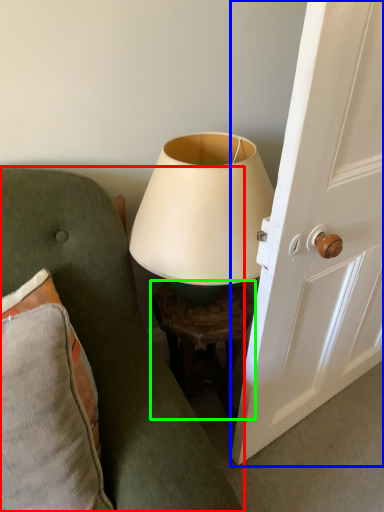
Question: Considering the real-world distances, which object is farthest from furniture (highlighted by a red box)? screen door (highlighted by a blue box) or table (highlighted by a green box)?

Choices:
 (A) screen door
 (B) table

Answer: (A)